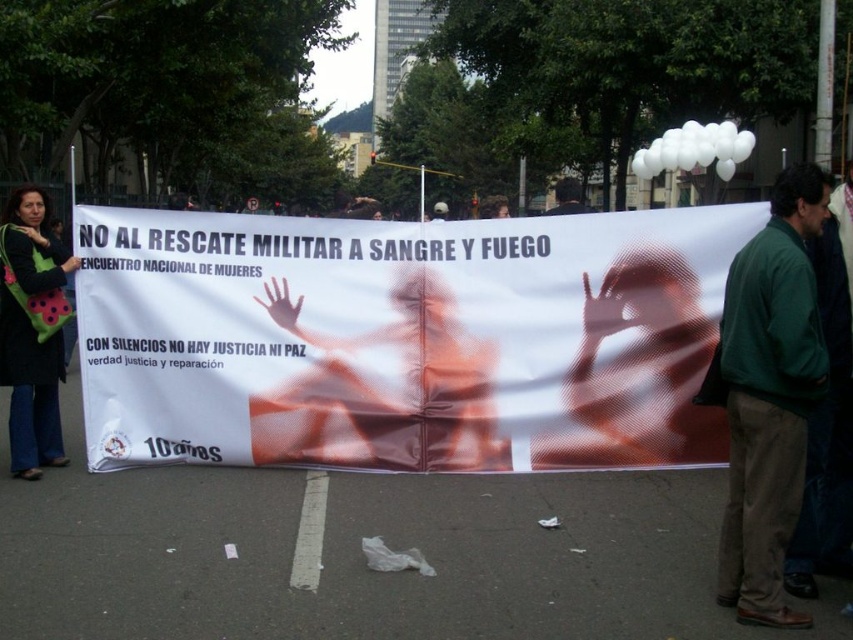
You are a photographer standing at the camera position. You want to capture a closeup shot of the point at coordinates point (572, 196). Your current zoom level allows you to focus on objects within 5 meters. Do you need to adjust your zoom to get a clear closeup of that point?

The distance of point (572, 196) from camera is 8.54 meters, so you need to adjust your zoom to get a clear closeup since the point is beyond the 5 meters focus range.

You are attending a protest and need to locate your friend who has dark brown hair. You see a black felt bag at left. Is the black felt bag closer to you than the dark brown hair at upper center?

Yes, the black felt bag at left is closer to the viewer than the dark brown hair at upper center according to the description.